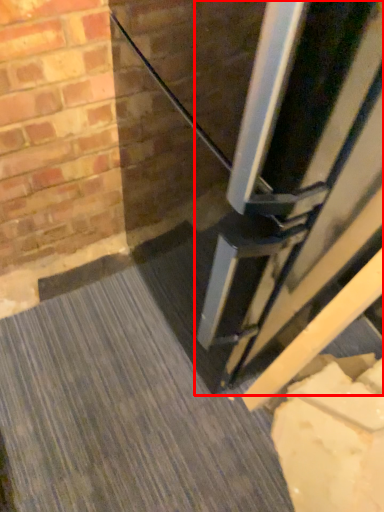
Question: Observing the image, what is the correct spatial positioning of door (annotated by the red box) in reference to concrete?

Choices:
 (A) left
 (B) right

Answer: (B)